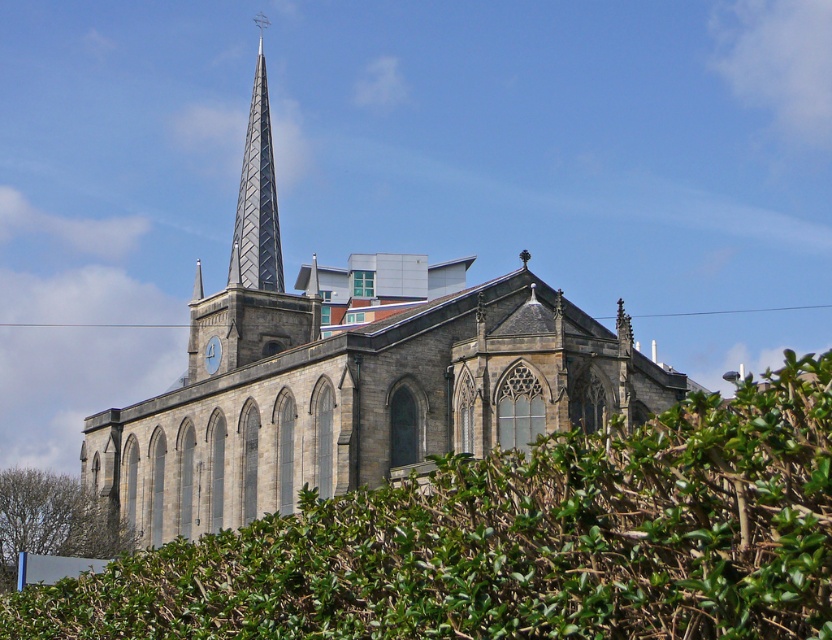
Question: Which object is positioned farthest from the metallic diamond-patterned spire at center?

Choices:
 (A) green leafy hedge at lower center
 (B) green leafy tree at lower left

Answer: (A)

Question: Does stone church at center have a smaller size compared to green leafy tree at lower left?

Choices:
 (A) yes
 (B) no

Answer: (B)

Question: Considering the real-world distances, which object is farthest from the green leafy hedge at lower center?

Choices:
 (A) metallic diamond-patterned spire at center
 (B) shiny metallic spire at upper center
 (C) green leafy tree at lower left

Answer: (A)

Question: Which of the following is the farthest from the observer?

Choices:
 (A) (266, 19)
 (B) (226, 355)

Answer: (A)

Question: From the image, what is the correct spatial relationship of shiny metallic spire at upper center in relation to green leafy tree at lower left?

Choices:
 (A) above
 (B) below

Answer: (A)

Question: Is stone church at center to the right of metallic diamond-patterned spire at center from the viewer's perspective?

Choices:
 (A) yes
 (B) no

Answer: (A)